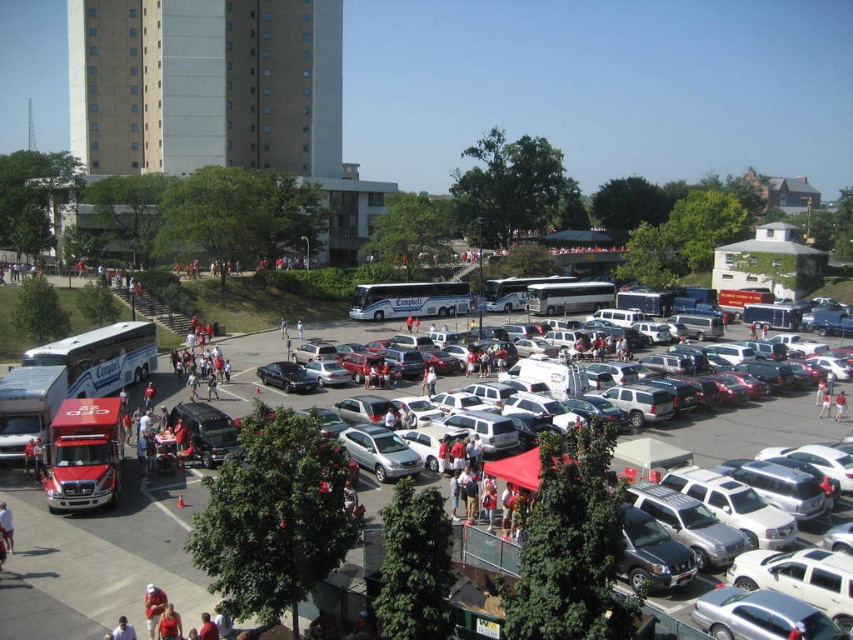
You are a parking attendant trying to fit a new bus into the parking lot. You see the white matte bus at upper left and the white metallic bus at center. Which bus has a wider body that might require more space to park?

The white matte bus at upper left has a wider body than the white metallic bus at center, so it would require more space to park.

You are standing at the center of the parking lot and want to find the white matte bus at upper left. According to the image, where should you look relative to your position?

The white matte bus at upper left is located at the coordinates point (77, 600), so you should look towards the upper left direction from your current position in the center of the parking lot.